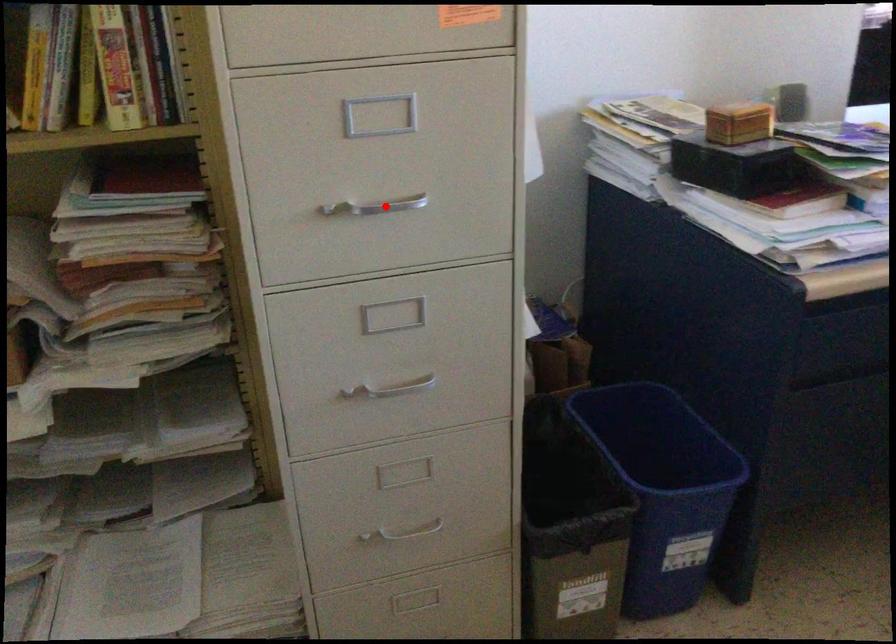
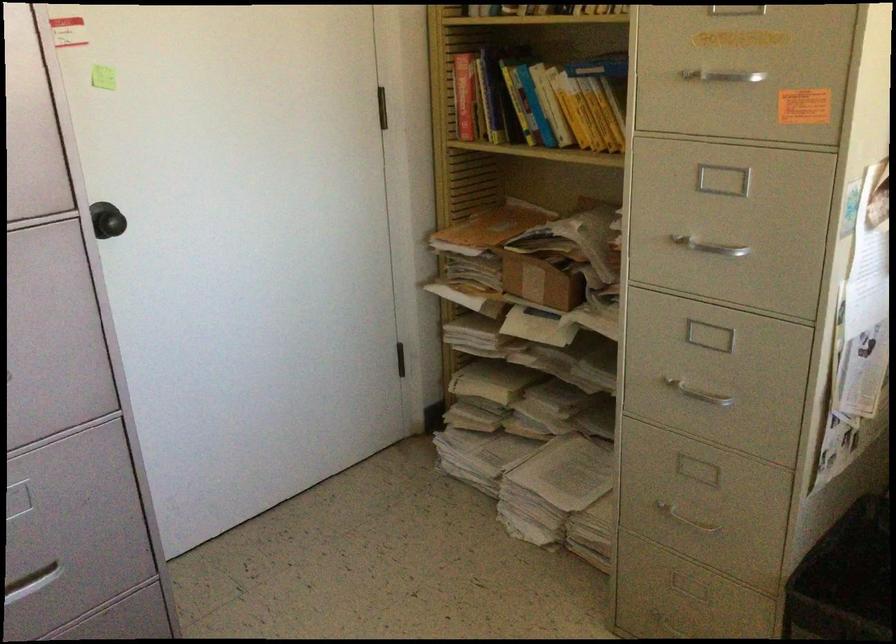
Question: I am providing you with two images of the same scene from different viewpoints. Given a red point in image1, look at the same physical point in image2. Is it:

Choices:
 (A) Closer to the viewpoint
 (B) Farther from the viewpoint

Answer: (B)